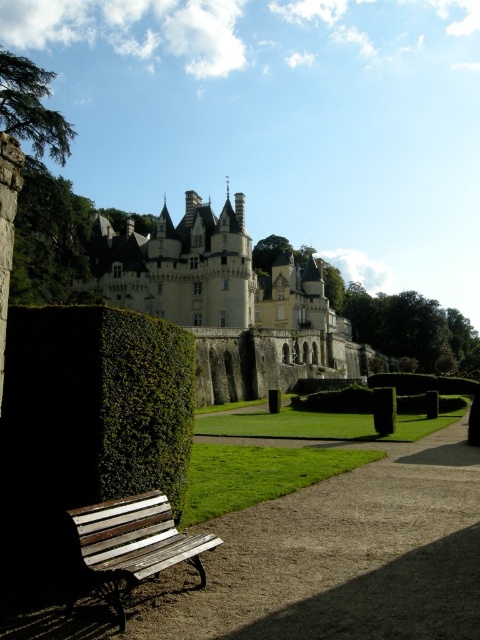
Can you confirm if brown gravel path at lower center is positioned to the left of green leafy hedge at lower center?

Correct, you'll find brown gravel path at lower center to the left of green leafy hedge at lower center.

Which is more to the right, brown gravel path at lower center or green leafy hedge at lower center?

Positioned to the right is green leafy hedge at lower center.

Is point (470, 513) positioned after point (388, 406)?

No.

Locate an element on the screen. The width and height of the screenshot is (480, 640). brown gravel path at lower center is located at coordinates (323, 561).

Who is positioned more to the right, stone castle at center or green leafy hedge at lower center?

green leafy hedge at lower center is more to the right.

Who is more forward, (212, 381) or (388, 422)?

Point (388, 422) is in front.

Describe the element at coordinates (229, 301) in the screenshot. Image resolution: width=480 pixels, height=640 pixels. I see `stone castle at center` at that location.

The image size is (480, 640). In order to click on stone castle at center in this screenshot , I will do 229,301.

Based on the photo, does dark green hedge at lower left have a larger size compared to stone castle at center?

No.

Is point (113, 337) positioned in front of point (331, 314)?

Yes, it is.

Find the location of `dark green hedge at lower left`. dark green hedge at lower left is located at coordinates (96, 404).